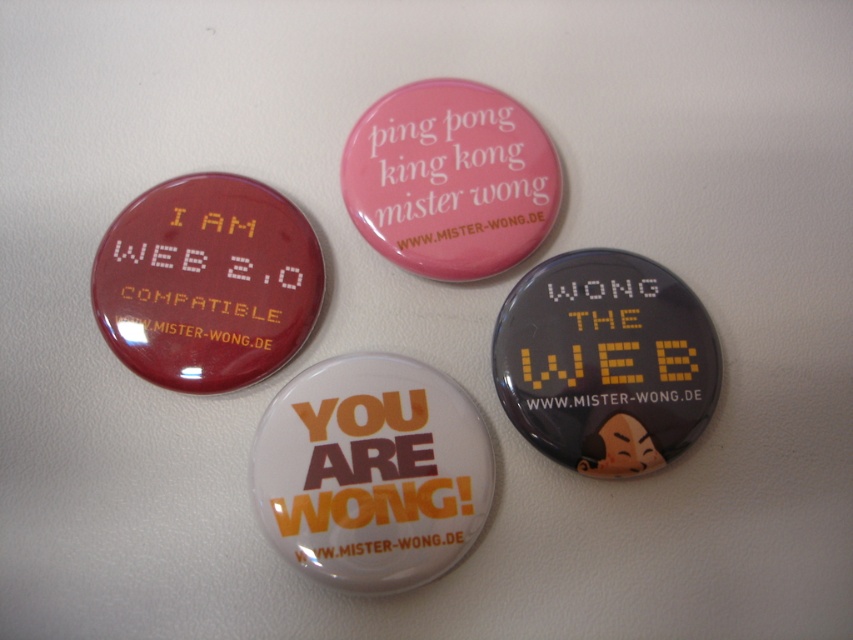
You are a designer checking the layout of a promotional badge. You notice the pink glossy button at upper center and the black matte text at center. Which element is closer to the viewer?

The pink glossy button at upper center is closer to the viewer than the black matte text at center.

What is located at the coordinates point (605, 362)?

A matte black button at center is located at point (605, 362).